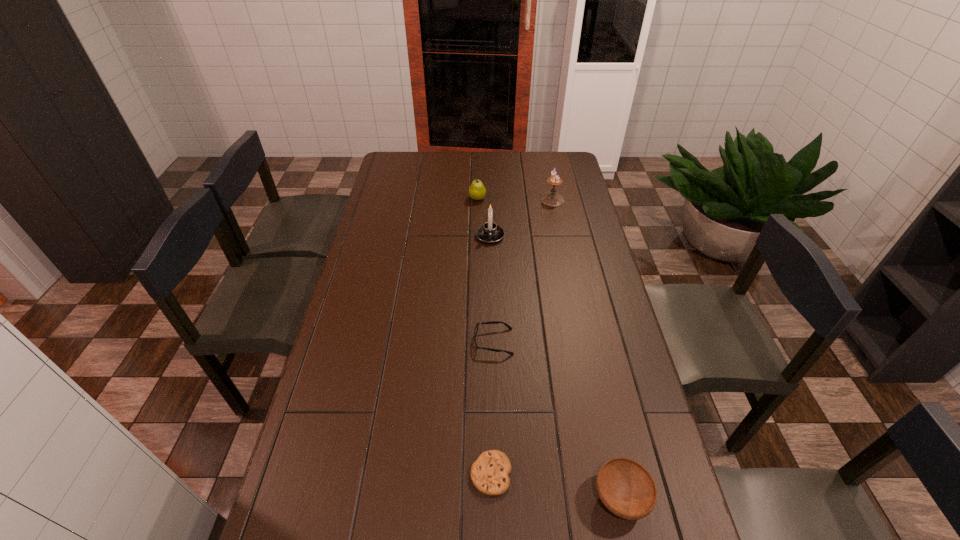
You are a GUI agent. You are given a task and a screenshot of the screen. Output one action in this format:
    pyautogui.click(x=<x>, y=<y>)
    Task: Click on the free space between the pear and the bowl
    This screenshot has height=540, width=960.
    Given the screenshot: What is the action you would take?
    pyautogui.click(x=549, y=348)

This screenshot has height=540, width=960. I want to click on free space between the pear and the nearer candle holder, so click(x=484, y=217).

Where is `free point between the spectacles and the left candle holder`? free point between the spectacles and the left candle holder is located at coordinates (492, 289).

Locate which object is the second closest to the cookie. Please provide its 2D coordinates. Your answer should be formatted as a tuple, i.e. [(x, y)], where the tuple contains the x and y coordinates of a point satisfying the conditions above.

[(492, 322)]

Locate which object ranks fourth in proximity to the fourth nearest object. Please provide its 2D coordinates. Your answer should be formatted as a tuple, i.e. [(x, y)], where the tuple contains the x and y coordinates of a point satisfying the conditions above.

[(489, 473)]

Where is `vacant area in the image that satisfies the following two spatial constraints: 1. on the front side of the shortest object; 2. on the left side of the bowl`? vacant area in the image that satisfies the following two spatial constraints: 1. on the front side of the shortest object; 2. on the left side of the bowl is located at coordinates (492, 497).

At what (x,y) coordinates should I click in order to perform the action: click on free space that satisfies the following two spatial constraints: 1. with a handle on the side of the left candle holder; 2. on the right side of the bowl. Please return your answer as a coordinate pair (x, y). The width and height of the screenshot is (960, 540). Looking at the image, I should click on (496, 497).

Where is `vacant area that satisfies the following two spatial constraints: 1. on the front-facing side of the fifth tallest object; 2. on the right side of the fourth tallest object`? The width and height of the screenshot is (960, 540). vacant area that satisfies the following two spatial constraints: 1. on the front-facing side of the fifth tallest object; 2. on the right side of the fourth tallest object is located at coordinates (498, 497).